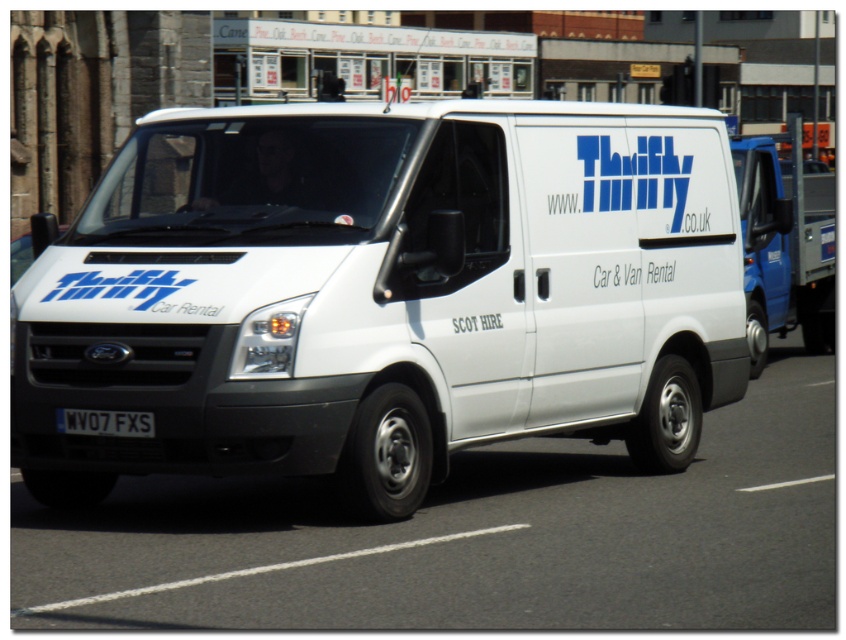
You are a delivery driver who needs to park the white matte van at center and the black plastic license plate at center into a parking spot that is only 2 meters tall. Can both fit vertically?

The white matte van at center is much taller than the black plastic license plate at center. Since the parking spot is only 2 meters tall, only the black plastic license plate at center might fit, but the white matte van at center is likely too tall to fit vertically.

You are a delivery driver who needs to park your white matte van at center in a parking spot that is exactly the same width as your van. There is a black plastic license plate at center on the van. Can you determine if the parking spot is wide enough for the van using the license plate?

The white matte van at center might be wider than black plastic license plate at center, so it is uncertain whether the parking spot is wide enough for the van based on the license plate size alone.

You are a pedestrian standing on the sidewalk observing the white matte van at center and the black plastic license plate at center. Which object is nearer to you?

The white matte van at center is closer to the viewer than the black plastic license plate at center.